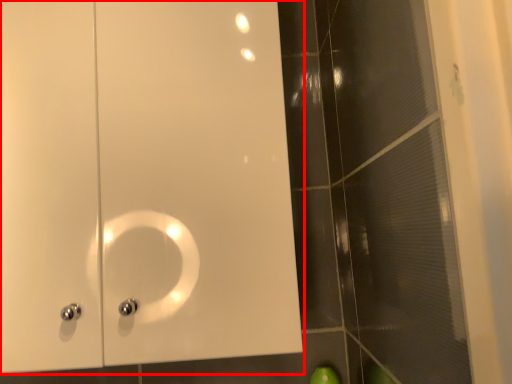
Question: From the image's perspective, where is door (annotated by the red box) located relative to glass door?

Choices:
 (A) above
 (B) below

Answer: (A)